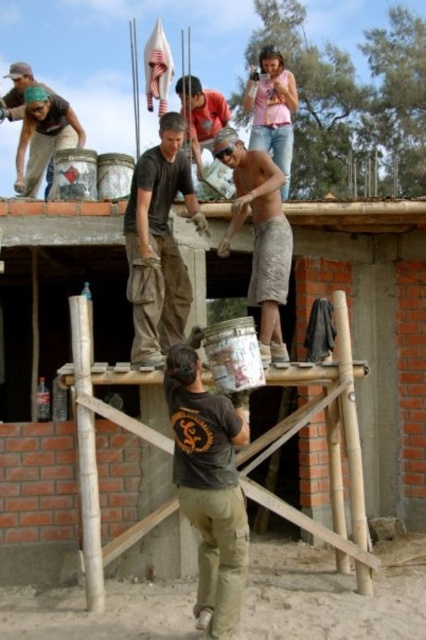
Question: Which of the following is the farthest from the observer?

Choices:
 (A) camouflage fabric shorts at center
 (B) matte black bucket at upper left
 (C) matte gray shirt at center
 (D) pink cotton shirt at upper center

Answer: (B)

Question: Does matte brown pants at center have a smaller size compared to camouflage fabric shorts at center?

Choices:
 (A) no
 (B) yes

Answer: (B)

Question: Is dark brown fabric shirt at center further to the viewer compared to matte gray shirt at center?

Choices:
 (A) no
 (B) yes

Answer: (A)

Question: Is dark brown fabric shirt at center to the left of matte black bucket at upper left from the viewer's perspective?

Choices:
 (A) no
 (B) yes

Answer: (A)

Question: Among these objects, which one is farthest from the camera?

Choices:
 (A) matte gray shirt at center
 (B) pink cotton shirt at upper center
 (C) dark brown fabric shirt at center
 (D) camouflage fabric shorts at center

Answer: (A)

Question: Which of the following is the closest to the observer?

Choices:
 (A) matte gray shirt at center
 (B) camouflage fabric shorts at center

Answer: (B)